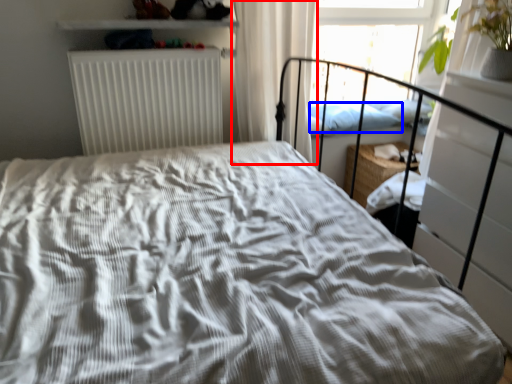
Question: Among these objects, which one is farthest to the camera, curtain (highlighted by a red box) or pillow (highlighted by a blue box)?

Choices:
 (A) curtain
 (B) pillow

Answer: (B)